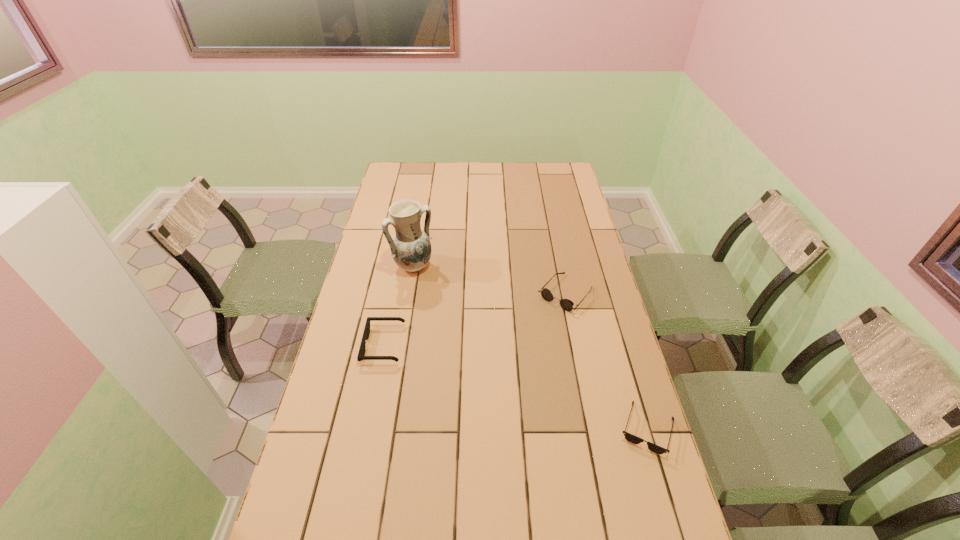
You are a GUI agent. You are given a task and a screenshot of the screen. Output one action in this format:
    pyautogui.click(x=<x>, y=<y>)
    Task: Click on the leftmost sunglasses
    The image size is (960, 540).
    Given the screenshot: What is the action you would take?
    pyautogui.click(x=361, y=356)

Where is `the third farthest object`? The width and height of the screenshot is (960, 540). the third farthest object is located at coordinates (361, 356).

Find the location of a particular element. This screenshot has height=540, width=960. the nearest sunglasses is located at coordinates (633, 439).

The width and height of the screenshot is (960, 540). Find the location of `the second tallest object`. the second tallest object is located at coordinates (566, 304).

You are a GUI agent. You are given a task and a screenshot of the screen. Output one action in this format:
    pyautogui.click(x=<x>, y=<y>)
    Task: Click on the farthest sunglasses
    Image resolution: width=960 pixels, height=540 pixels.
    Given the screenshot: What is the action you would take?
    pyautogui.click(x=566, y=304)

Find the location of `pottery`. pottery is located at coordinates (410, 247).

This screenshot has width=960, height=540. Find the location of `free space located 0.070m on the front-facing side of the leftmost sunglasses`. free space located 0.070m on the front-facing side of the leftmost sunglasses is located at coordinates (343, 345).

I want to click on free region located on the lenses of the nearest object, so click(x=670, y=508).

Identify the location of free location located on the front-facing side of the farthest sunglasses. (511, 355).

This screenshot has width=960, height=540. I want to click on blank space located 0.160m on the front-facing side of the farthest sunglasses, so point(525,340).